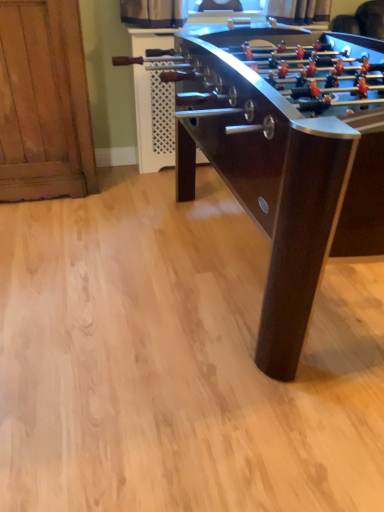
The width and height of the screenshot is (384, 512). In order to click on free location to the right of wooden cabinet at left in this screenshot , I will do `click(126, 194)`.